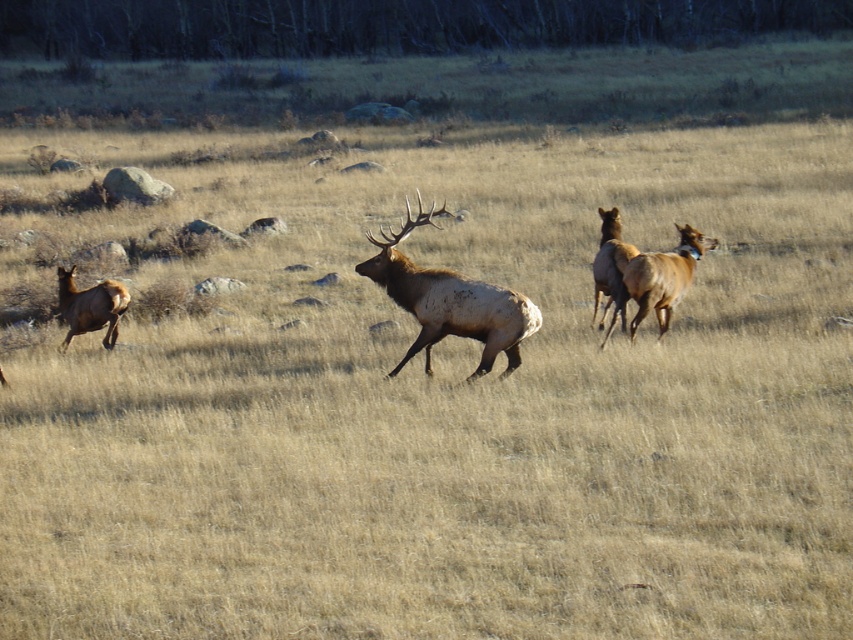
Question: Does brown velvet deer at right appear under brown velvet antlered deer at center?

Choices:
 (A) no
 (B) yes

Answer: (A)

Question: Based on their relative distances, which object is farther from the brown velvet deer at center?

Choices:
 (A) brown velvet antlered deer at center
 (B) brown velvet deer at left

Answer: (B)

Question: Does brown velvet deer at right appear over brown velvet antlered deer at center?

Choices:
 (A) yes
 (B) no

Answer: (A)

Question: Does brown velvet deer at center appear on the right side of brown velvet deer at right?

Choices:
 (A) yes
 (B) no

Answer: (B)

Question: Which of these objects is positioned farthest from the brown velvet deer at center?

Choices:
 (A) brown velvet antlered deer at center
 (B) brown velvet deer at left
 (C) brown velvet deer at right

Answer: (B)

Question: Considering the real-world distances, which object is closest to the brown velvet deer at right?

Choices:
 (A) brown velvet deer at center
 (B) brown velvet deer at left
 (C) brown velvet antlered deer at center

Answer: (C)